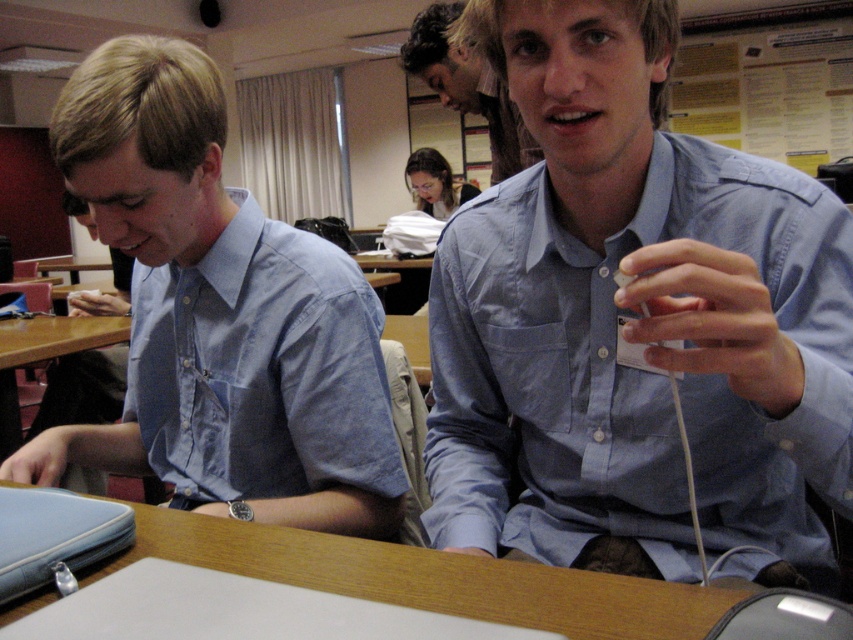
You are a photographer trying to capture a closeup of the blue shirt at center and the matte black hair at upper center. Which object should you zoom in on first to ensure both are in focus?

The blue shirt at center is wider than matte black hair at upper center, so you should zoom in on the blue shirt at center first to ensure both are in focus.

You are a photographer setting up a shot of two men in blue shirts. You want to ensure both are centered in the frame. Since the blue shirt at center is on the left of the blue shirt at upper center, where should you adjust the camera to balance them?

To balance the blue shirt at center and the blue shirt at upper center, move the camera slightly to the right so both are centered, as the blue shirt at center is on the left side of the blue shirt at upper center.